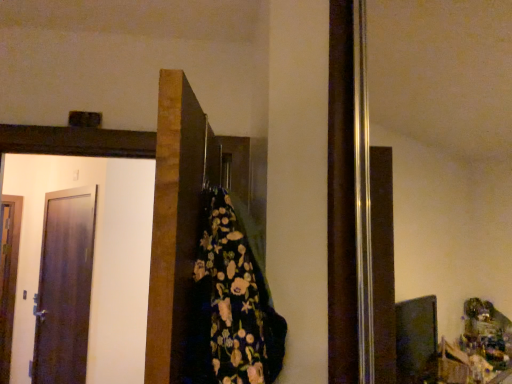
Question: Is dark brown wooden door at center, the 3th door positioned from the back, bigger than matte dark brown door at left, acting as the 2th door starting from the back?

Choices:
 (A) no
 (B) yes

Answer: (B)

Question: Is dark brown wooden door at center, the 3th door positioned from the back, directly adjacent to matte dark brown door at left, placed as the 2th door when sorted from front to back?

Choices:
 (A) no
 (B) yes

Answer: (A)

Question: Can you confirm if dark brown wooden door at center, the 3th door positioned from the back, is positioned to the left of matte dark brown door at left, acting as the 2th door starting from the back?

Choices:
 (A) no
 (B) yes

Answer: (A)

Question: Can you confirm if dark brown wooden door at center, arranged as the 3th door when viewed from the left, is positioned to the right of matte dark brown door at left, placed as the 2th door when sorted from front to back?

Choices:
 (A) yes
 (B) no

Answer: (A)

Question: Would you say dark brown wooden door at center, the 3th door positioned from the back, is outside matte dark brown door at left, the 2th door when ordered from right to left?

Choices:
 (A) yes
 (B) no

Answer: (A)

Question: Which is correct: matte dark brown door at left, arranged as the 2th door when viewed from the left, is inside floral-patterned fabric at center, or outside of it?

Choices:
 (A) outside
 (B) inside

Answer: (A)

Question: Looking at their shapes, would you say matte dark brown door at left, arranged as the 2th door when viewed from the left, is wider or thinner than floral-patterned fabric at center?

Choices:
 (A) wide
 (B) thin

Answer: (B)

Question: Is matte dark brown door at left, the 2th door when ordered from right to left, in front of or behind floral-patterned fabric at center in the image?

Choices:
 (A) front
 (B) behind

Answer: (B)

Question: Considering the positions of matte dark brown door at left, arranged as the 2th door when viewed from the left, and floral-patterned fabric at center in the image, is matte dark brown door at left, arranged as the 2th door when viewed from the left, bigger or smaller than floral-patterned fabric at center?

Choices:
 (A) small
 (B) big

Answer: (B)

Question: From a real-world perspective, is matte dark brown door at left, placed as the 2th door when sorted from front to back, physically located above or below dark brown wooden door at center, the 3th door positioned from the back?

Choices:
 (A) above
 (B) below

Answer: (B)

Question: Based on their sizes in the image, would you say matte dark brown door at left, placed as the 2th door when sorted from front to back, is bigger or smaller than dark brown wooden door at center, arranged as the 3th door when viewed from the left?

Choices:
 (A) small
 (B) big

Answer: (A)

Question: Choose the correct answer: Is matte dark brown door at left, placed as the 2th door when sorted from front to back, inside dark brown wooden door at center, which is counted as the first door, starting from the front, or outside it?

Choices:
 (A) inside
 (B) outside

Answer: (B)

Question: Based on their positions, is matte dark brown door at left, arranged as the 2th door when viewed from the left, located to the left or right of dark brown wooden door at center, the 3th door positioned from the back?

Choices:
 (A) left
 (B) right

Answer: (A)

Question: Is point (8, 269) positioned closer to the camera than point (160, 362)?

Choices:
 (A) closer
 (B) farther

Answer: (B)

Question: Would you say wooden door at left, acting as the 3th door starting from the front, is inside or outside dark brown wooden door at center, which is counted as the first door, starting from the front?

Choices:
 (A) inside
 (B) outside

Answer: (B)